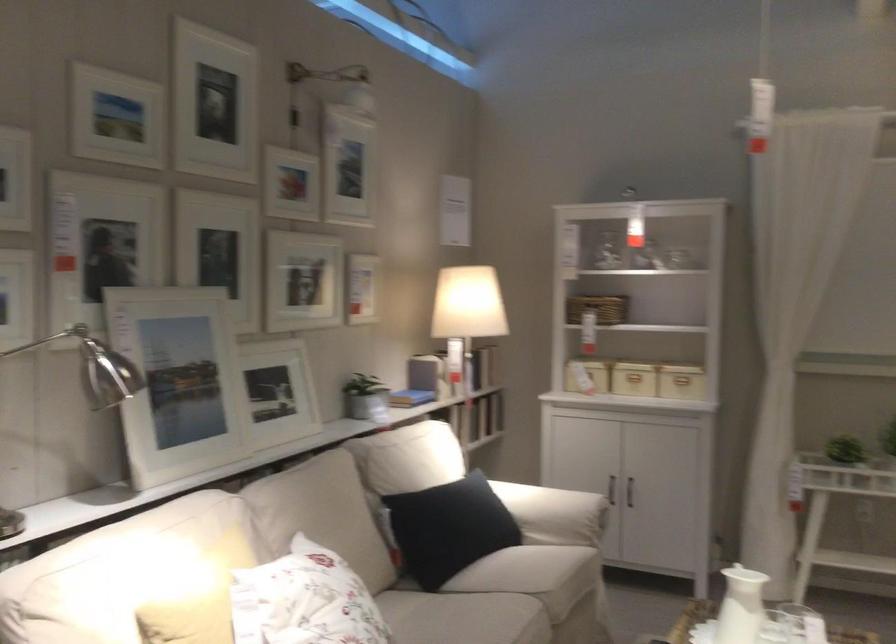
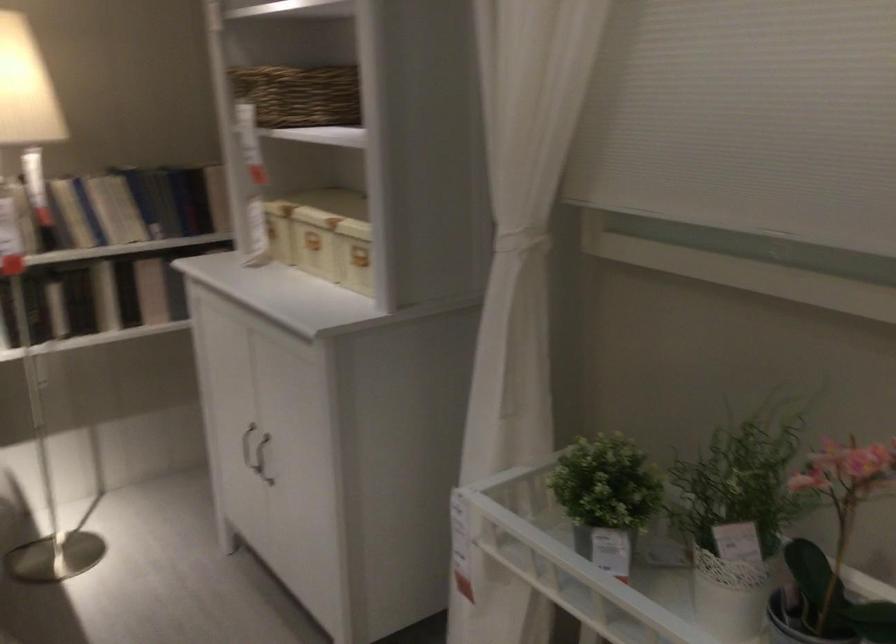
Find the pixel in the second image that matches pixel 457 428 in the first image.

(55, 307)